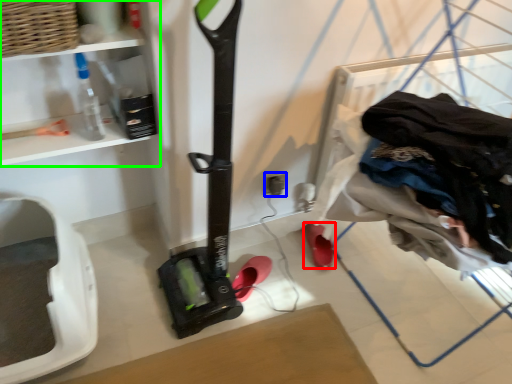
Question: Which object is the farthest from footwear (highlighted by a red box)? Choose among these: electric outlet (highlighted by a blue box) or shelf (highlighted by a green box).

Choices:
 (A) electric outlet
 (B) shelf

Answer: (B)